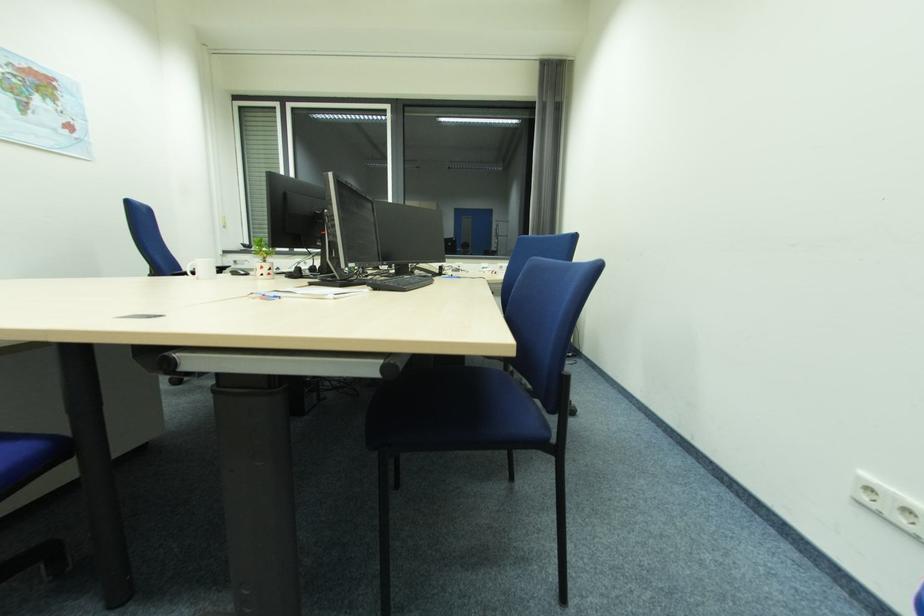
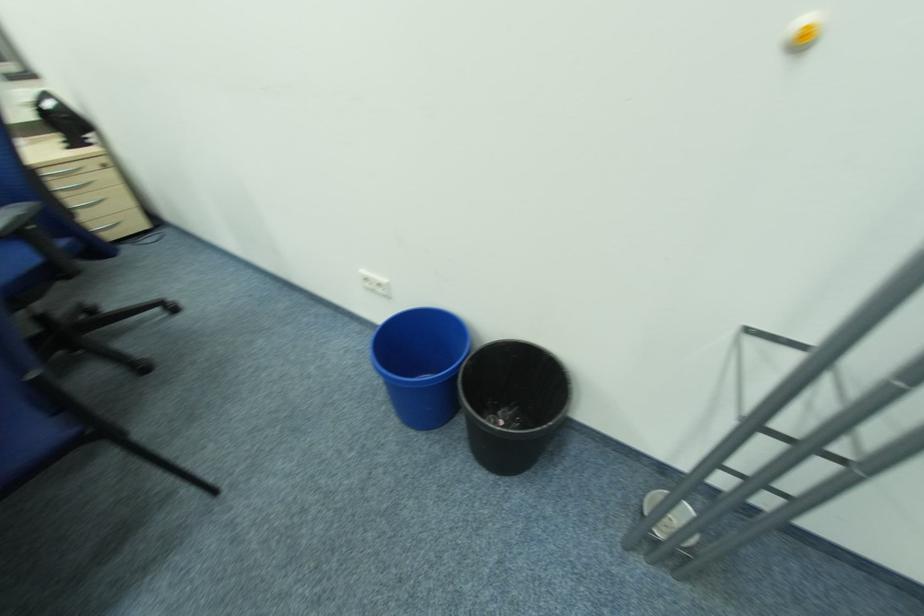
The first image is from the beginning of the video and the second image is from the end. How did the camera likely rotate when shooting the video?

The camera rotated toward right-down.